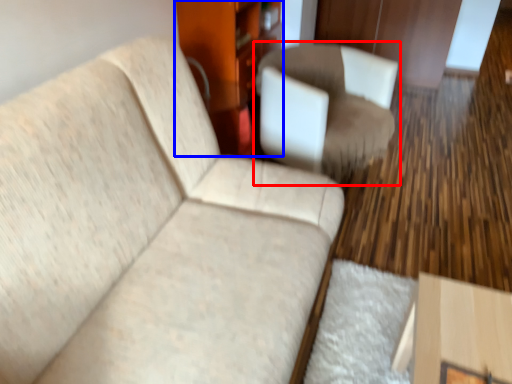
Question: Which of the following is the closest to the observer, chair (highlighted by a red box) or dresser (highlighted by a blue box)?

Choices:
 (A) chair
 (B) dresser

Answer: (A)